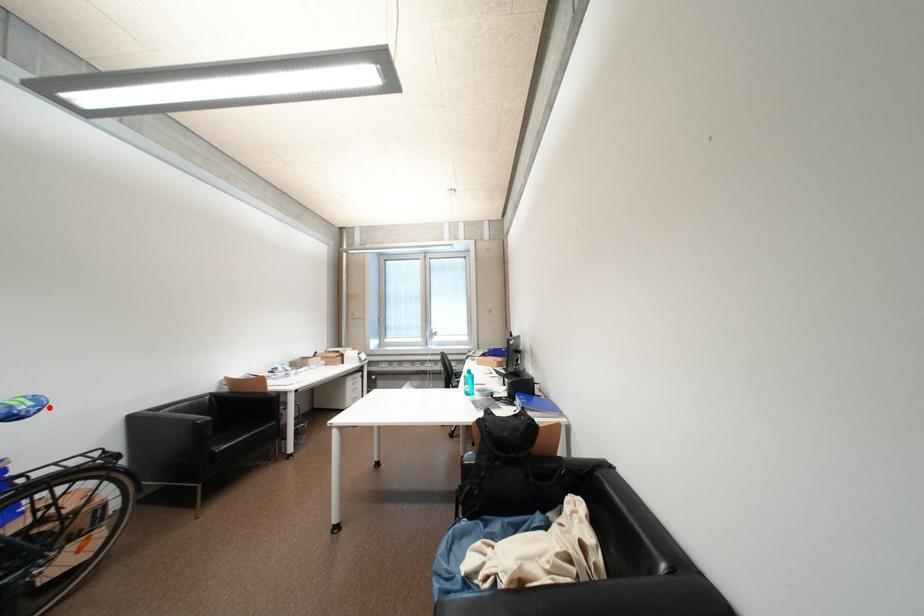
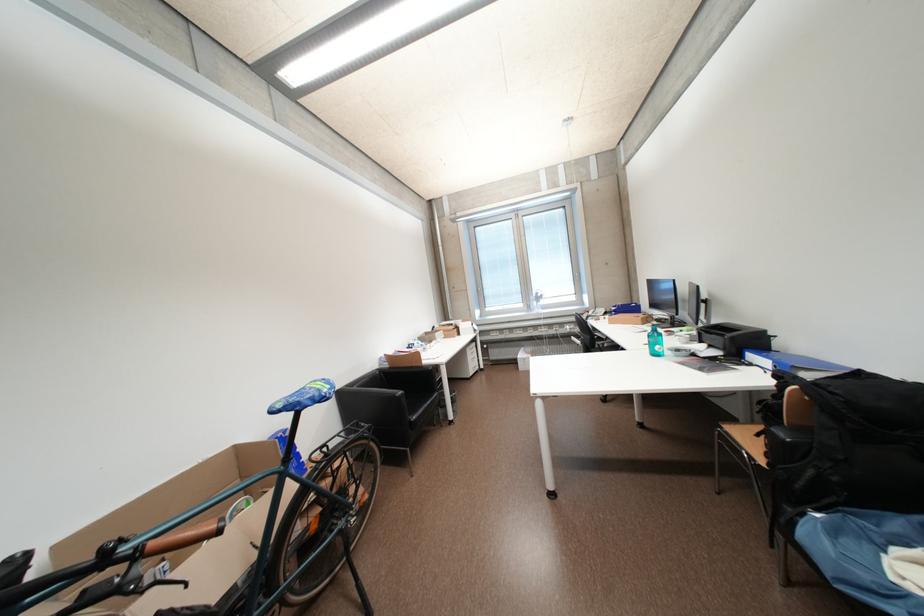
Question: I am providing you with two images of the same scene from different viewpoints. Image1 has a red point marked. In image2, the corresponding 3D location appears at what relative position? Reply with the corresponding letter.

Choices:
 (A) Closer
 (B) Farther

Answer: (A)